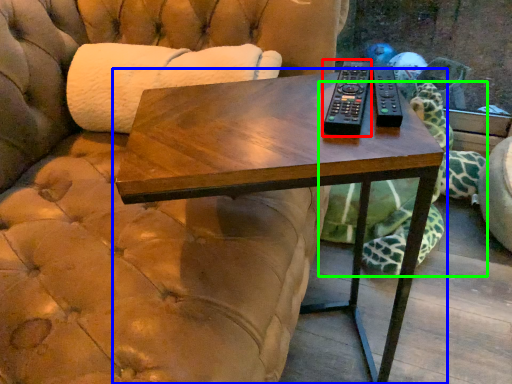
Question: Estimate the real-world distances between objects in this image. Which object is closer to remote (highlighted by a red box), table (highlighted by a blue box) or tortoise (highlighted by a green box)?

Choices:
 (A) table
 (B) tortoise

Answer: (A)